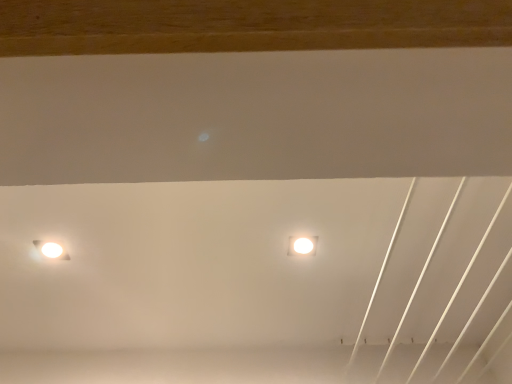
Question: Is white glossy lamp at upper center, the 1th lamp in the right-to-left sequence, further to camera compared to white glossy lamp at left, which is the first lamp from left to right?

Choices:
 (A) no
 (B) yes

Answer: (B)

Question: Would you say white glossy lamp at upper center, placed as the 2th lamp when sorted from left to right, contains white glossy lamp at left, marked as the 2th lamp in a right-to-left arrangement?

Choices:
 (A) no
 (B) yes

Answer: (A)

Question: Does white glossy lamp at upper center, placed as the 2th lamp when sorted from left to right, have a smaller size compared to white glossy lamp at left, which is the first lamp from left to right?

Choices:
 (A) yes
 (B) no

Answer: (A)

Question: Is white glossy lamp at upper center, placed as the 2th lamp when sorted from left to right, wider than white glossy lamp at left, marked as the 2th lamp in a right-to-left arrangement?

Choices:
 (A) no
 (B) yes

Answer: (B)

Question: Is white glossy lamp at upper center, placed as the 2th lamp when sorted from left to right, at the right side of white glossy lamp at left, which is the first lamp from left to right?

Choices:
 (A) no
 (B) yes

Answer: (B)

Question: Is white glossy lamp at upper center, placed as the 2th lamp when sorted from left to right, closer to camera compared to white glossy lamp at left, which is the first lamp from left to right?

Choices:
 (A) no
 (B) yes

Answer: (A)

Question: Can you confirm if white glossy lamp at left, marked as the 2th lamp in a right-to-left arrangement, is smaller than white glossy lamp at upper center, the 1th lamp in the right-to-left sequence?

Choices:
 (A) no
 (B) yes

Answer: (A)

Question: Considering the relative sizes of white glossy lamp at left, which is the first lamp from left to right, and white glossy lamp at upper center, placed as the 2th lamp when sorted from left to right, in the image provided, is white glossy lamp at left, which is the first lamp from left to right, bigger than white glossy lamp at upper center, placed as the 2th lamp when sorted from left to right,?

Choices:
 (A) no
 (B) yes

Answer: (B)

Question: Is white glossy lamp at left, marked as the 2th lamp in a right-to-left arrangement, not within white glossy lamp at upper center, placed as the 2th lamp when sorted from left to right?

Choices:
 (A) yes
 (B) no

Answer: (A)

Question: Does white glossy lamp at left, which is the first lamp from left to right, have a lesser width compared to white glossy lamp at upper center, the 1th lamp in the right-to-left sequence?

Choices:
 (A) no
 (B) yes

Answer: (B)

Question: Can white glossy lamp at upper center, the 1th lamp in the right-to-left sequence, be found inside white glossy lamp at left, marked as the 2th lamp in a right-to-left arrangement?

Choices:
 (A) no
 (B) yes

Answer: (A)

Question: Does white glossy lamp at left, which is the first lamp from left to right, lie behind white glossy lamp at upper center, placed as the 2th lamp when sorted from left to right?

Choices:
 (A) no
 (B) yes

Answer: (A)

Question: From a real-world perspective, is white glossy lamp at left, which is the first lamp from left to right, above or below white glossy lamp at upper center, placed as the 2th lamp when sorted from left to right?

Choices:
 (A) above
 (B) below

Answer: (A)